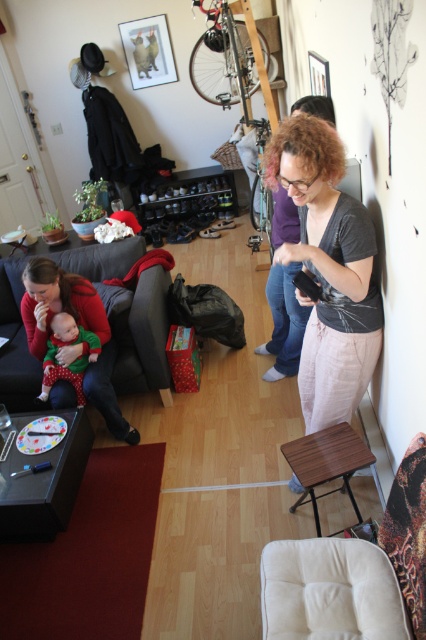
You are a delivery person trying to place a large package that is 2 meters long in the living room. The package needs to be placed horizontally between the beige fabric armchair at lower right and the dark gray fabric couch at lower left. Is there enough space for the package to fit horizontally between them?

The beige fabric armchair at lower right and the dark gray fabric couch at lower left are 1.83 meters apart. Since the package is 2 meters long, which is longer than the distance between them, the package cannot fit horizontally between them.

You are standing at the point marked by the coordinates point (354,573). Looking around, you see the beige fabric armchair at lower right. Which direction should you move to reach the beige fabric armchair at lower right?

The point (354,573) already indicates the location of the beige fabric armchair at lower right, so you are already at the beige fabric armchair at lower right.

Based on the scene description, where is the beige fabric armchair at lower right located in terms of coordinates?

The beige fabric armchair at lower right is located at coordinates point (354, 573).